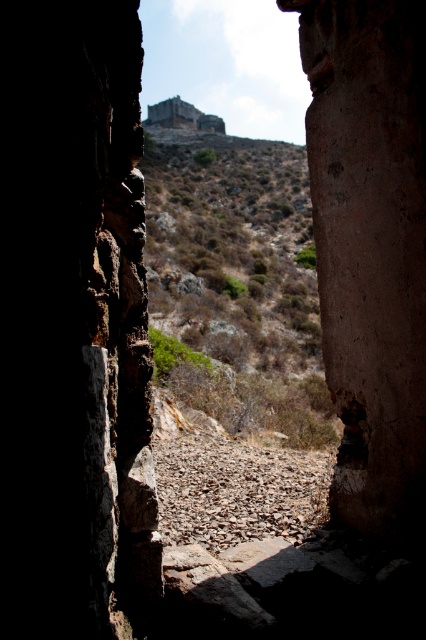
You are a hiker carrying a backpack and need to pass through the narrow stone doorway. You notice two features ahead of you through the doorway. The smooth stone hole at center and the rustic stone ruins at upper center. Which of these two features is narrower in width?

The smooth stone hole at center has a lesser width compared to rustic stone ruins at upper center, so it is narrower.

You are standing in front of the doorway and want to find the smooth stone hole at center. Where should you look relative to the doorway?

The smooth stone hole at center is located at the coordinates (351,429), which is towards the lower right side of the doorway.